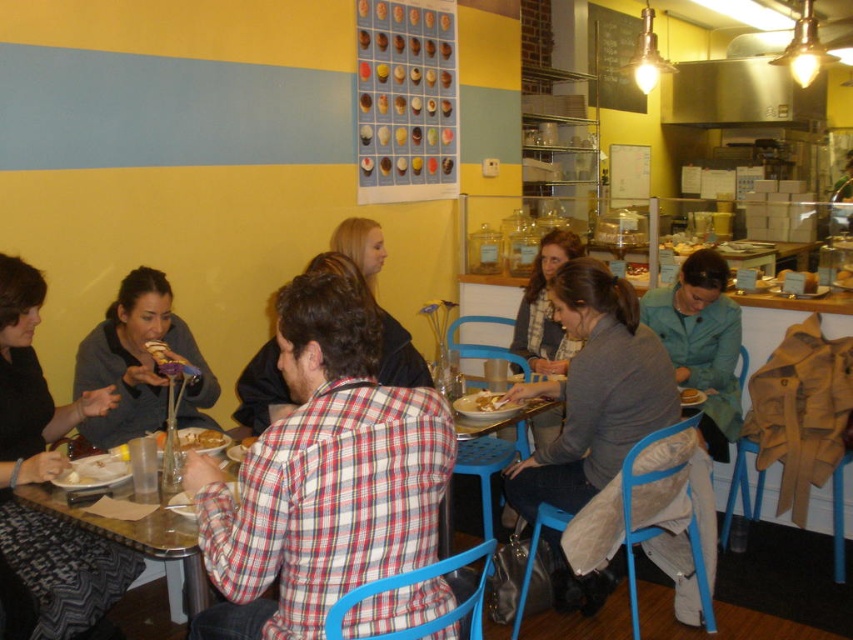
Question: Which of these objects is positioned closest to the white matte plate at center?

Choices:
 (A) metallic silver table at lower left
 (B) plaid shirt at center

Answer: (A)

Question: Which point appears closest to the camera in this image?

Choices:
 (A) (399, 332)
 (B) (689, 401)
 (C) (642, 298)

Answer: (A)

Question: Is white creamy soup at center positioned behind white matte bowl at center?

Choices:
 (A) no
 (B) yes

Answer: (A)

Question: Does matte black jacket at left have a smaller size compared to golden flaky pie at center?

Choices:
 (A) yes
 (B) no

Answer: (B)

Question: Can you confirm if white matte bowl at center is wider than golden flaky pie at center?

Choices:
 (A) yes
 (B) no

Answer: (B)

Question: Which object is the closest to the gray wool sweater at center?

Choices:
 (A) golden flaky pie at center
 (B) white matte plate at center
 (C) white matte bowl at center

Answer: (B)